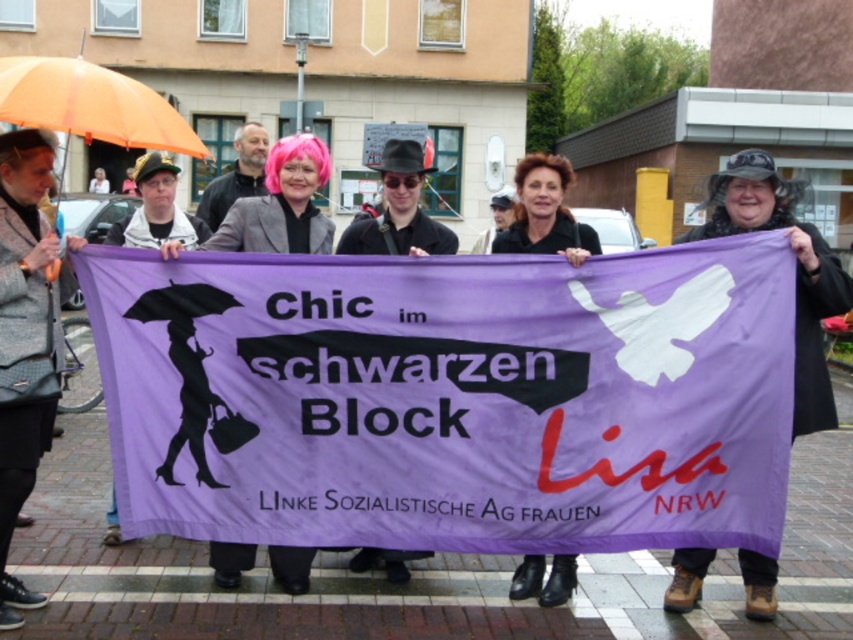
Describe the element at coordinates (450, 397) in the screenshot. I see `purple fabric banner at center` at that location.

Can you confirm if purple fabric banner at center is positioned above pink hair at center?

Incorrect, purple fabric banner at center is not positioned above pink hair at center.

What are the coordinates of `purple fabric banner at center` in the screenshot? It's located at (450, 397).

Find the location of a particular element. purple fabric banner at center is located at coordinates (450, 397).

Can you confirm if purple fabric banner at center is shorter than black matte coat at center?

No, purple fabric banner at center is not shorter than black matte coat at center.

Can you confirm if purple fabric banner at center is positioned above black matte coat at center?

No.

Locate an element on the screen. purple fabric banner at center is located at coordinates (450, 397).

Locate an element on the screen. purple fabric banner at center is located at coordinates (450, 397).

Between orange fabric umbrella at upper left and pink hair at center, which one appears on the right side from the viewer's perspective?

From the viewer's perspective, pink hair at center appears more on the right side.

Which is behind, point (57, 100) or point (280, 576)?

Positioned behind is point (280, 576).

Image resolution: width=853 pixels, height=640 pixels. What are the coordinates of `orange fabric umbrella at upper left` in the screenshot? It's located at (91, 104).

Locate an element on the screen. orange fabric umbrella at upper left is located at coordinates (91, 104).